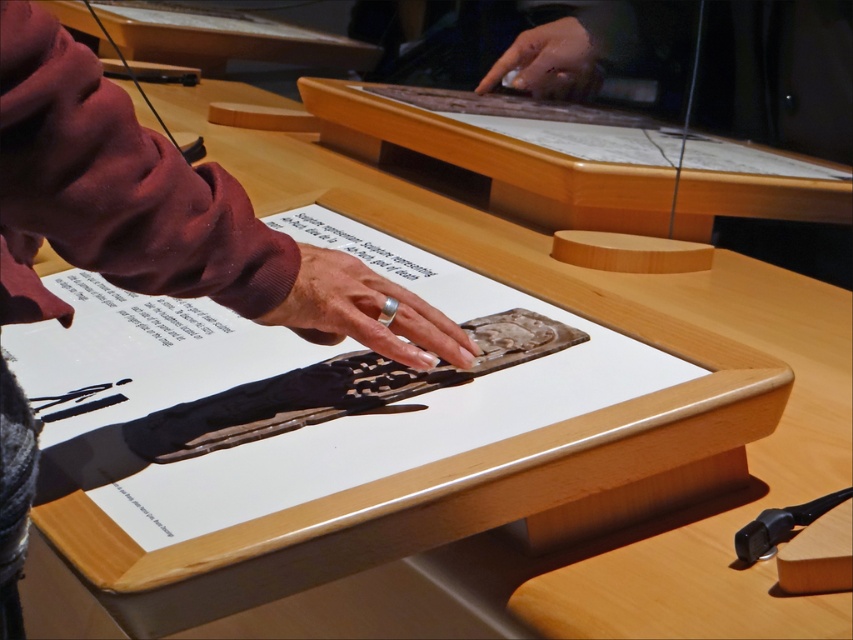
Which is below, wooden table at center or silver metallic ring at center?

Positioned lower is silver metallic ring at center.

Is wooden table at center taller than silver metallic ring at center?

Yes, wooden table at center is taller than silver metallic ring at center.

Measure the distance between point [830,192] and camera.

4.11 feet

At what (x,y) coordinates should I click in order to perform the action: click on wooden table at center. Please return your answer as a coordinate pair (x, y). Looking at the image, I should click on (492, 157).

Describe the element at coordinates (492, 157) in the screenshot. I see `wooden table at center` at that location.

Is point (589, 184) positioned behind point (216, 19)?

No.

Image resolution: width=853 pixels, height=640 pixels. Identify the location of wooden table at center. (492, 157).

Can you confirm if wooden table at upper center is taller than smooth skin hand at upper center?

Indeed, wooden table at upper center has a greater height compared to smooth skin hand at upper center.

Does wooden table at upper center appear over smooth skin hand at upper center?

Yes, wooden table at upper center is above smooth skin hand at upper center.

Image resolution: width=853 pixels, height=640 pixels. Describe the element at coordinates (225, 38) in the screenshot. I see `wooden table at upper center` at that location.

Where is `wooden table at upper center`? wooden table at upper center is located at coordinates (225, 38).